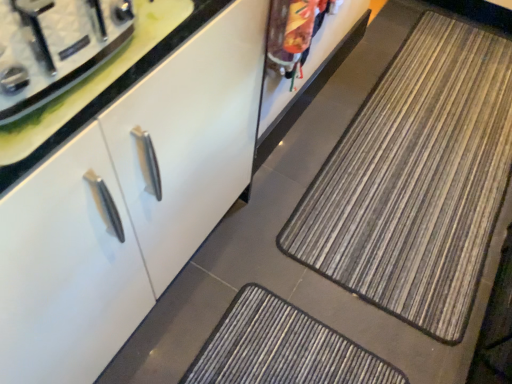
Question: Is white glossy cabinet at center spatially inside striped fabric mat at center, or outside of it?

Choices:
 (A) outside
 (B) inside

Answer: (A)

Question: From the image's perspective, is white glossy cabinet at center above or below striped fabric mat at center?

Choices:
 (A) below
 (B) above

Answer: (A)

Question: Which object is the farthest from the striped fabric mat at center?

Choices:
 (A) brushed metal stove top at upper left
 (B) white glossy cabinet at center

Answer: (A)

Question: Which is nearer to the white glossy cabinet at center?

Choices:
 (A) brushed metal stove top at upper left
 (B) striped fabric mat at center

Answer: (A)